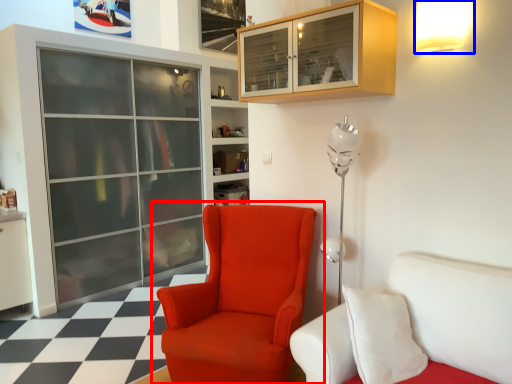
Question: Which of the following is the farthest to the observer, chair (highlighted by a red box) or light fixture (highlighted by a blue box)?

Choices:
 (A) chair
 (B) light fixture

Answer: (B)